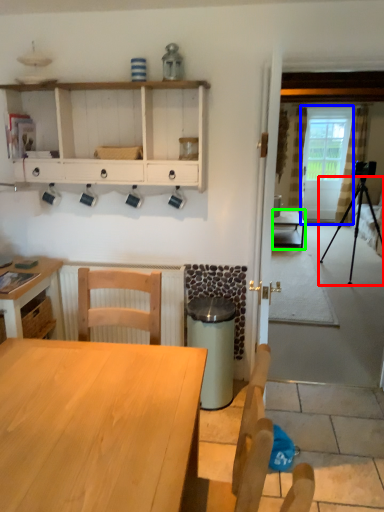
Question: Which is farther away from tripod (highlighted by a red box)? screen door (highlighted by a blue box) or table (highlighted by a green box)?

Choices:
 (A) screen door
 (B) table

Answer: (B)